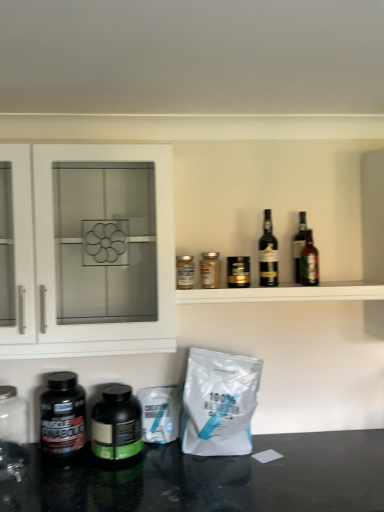
Where is `vacant area that is situated to the right of brown glass bottle at upper right, arranged as the seventh bottle when viewed from the left`? vacant area that is situated to the right of brown glass bottle at upper right, arranged as the seventh bottle when viewed from the left is located at coordinates (340, 285).